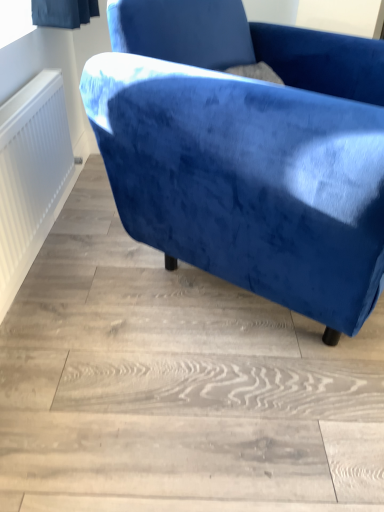
Question: Is white textured radiator at left wider or thinner than velvet blue armchair at upper right?

Choices:
 (A) thin
 (B) wide

Answer: (A)

Question: Relative to velvet blue armchair at upper right, is white textured radiator at left in front or behind?

Choices:
 (A) front
 (B) behind

Answer: (B)

Question: From the image's perspective, is white textured radiator at left located above or below velvet blue armchair at upper right?

Choices:
 (A) above
 (B) below

Answer: (B)

Question: In the image, is velvet blue armchair at upper right positioned in front of or behind white textured radiator at left?

Choices:
 (A) behind
 (B) front

Answer: (B)

Question: Choose the correct answer: Is velvet blue armchair at upper right inside white textured radiator at left or outside it?

Choices:
 (A) inside
 (B) outside

Answer: (B)

Question: Would you say velvet blue armchair at upper right is to the left or to the right of white textured radiator at left in the picture?

Choices:
 (A) left
 (B) right

Answer: (B)

Question: From their relative heights in the image, would you say velvet blue armchair at upper right is taller or shorter than white textured radiator at left?

Choices:
 (A) short
 (B) tall

Answer: (B)